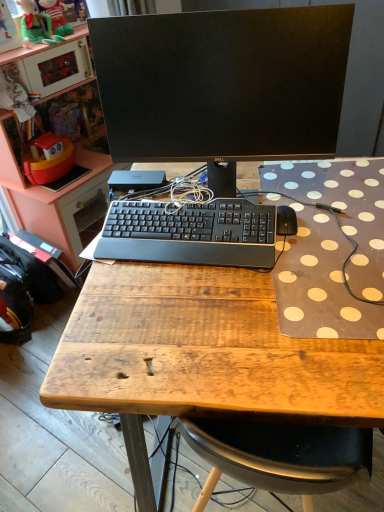
Image resolution: width=384 pixels, height=512 pixels. Identify the location of free space in front of black matte monitor at center. (231, 306).